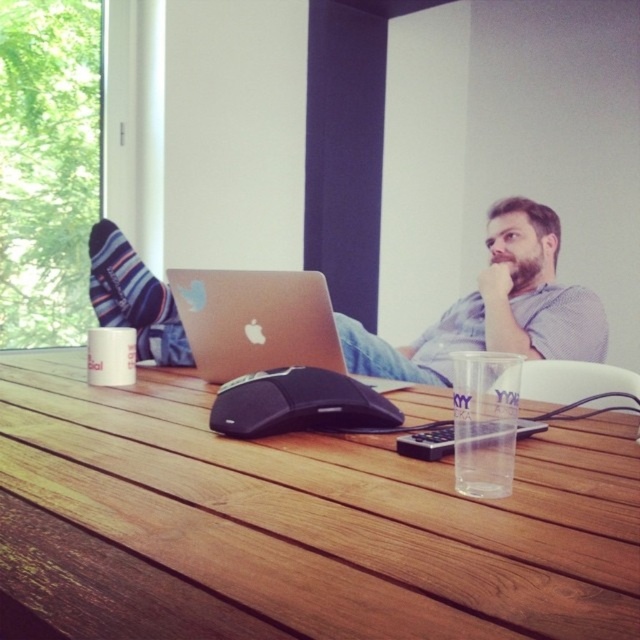
Question: Is wooden table at center bigger than black matte mouse at center?

Choices:
 (A) yes
 (B) no

Answer: (A)

Question: Estimate the real-world distances between objects in this image. Which object is closer to the wooden table at center?

Choices:
 (A) silver metallic laptop at center
 (B) matte silver laptop at center

Answer: (A)

Question: Which point is farther to the camera?

Choices:
 (A) silver metallic laptop at center
 (B) wooden table at center
 (C) black matte mouse at center
 (D) matte silver laptop at center

Answer: (D)

Question: Does wooden table at center have a smaller size compared to black matte mouse at center?

Choices:
 (A) no
 (B) yes

Answer: (A)

Question: Does matte silver laptop at center appear under silver metallic laptop at center?

Choices:
 (A) no
 (B) yes

Answer: (B)

Question: Which object is farther from the camera taking this photo?

Choices:
 (A) black matte mouse at center
 (B) silver metallic laptop at center
 (C) matte silver laptop at center

Answer: (C)